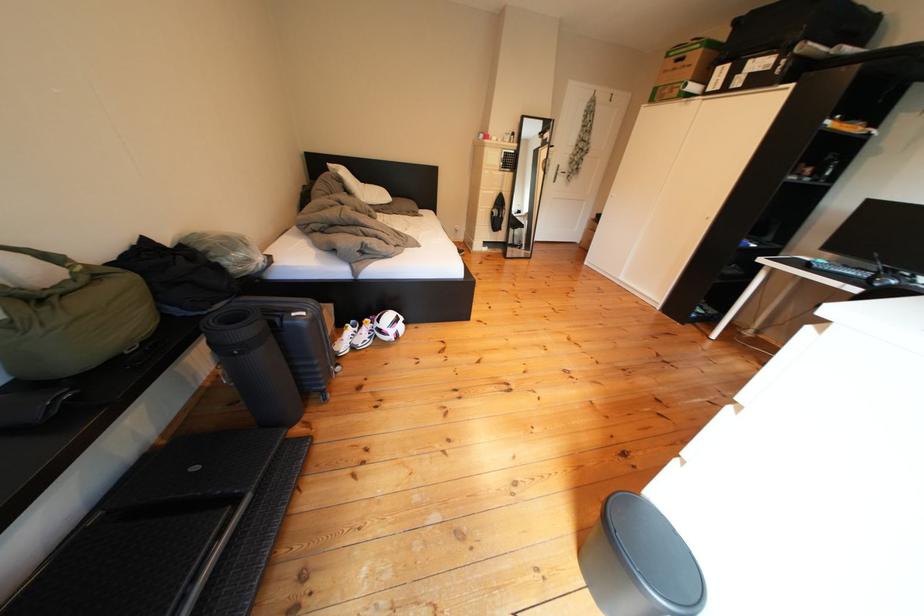
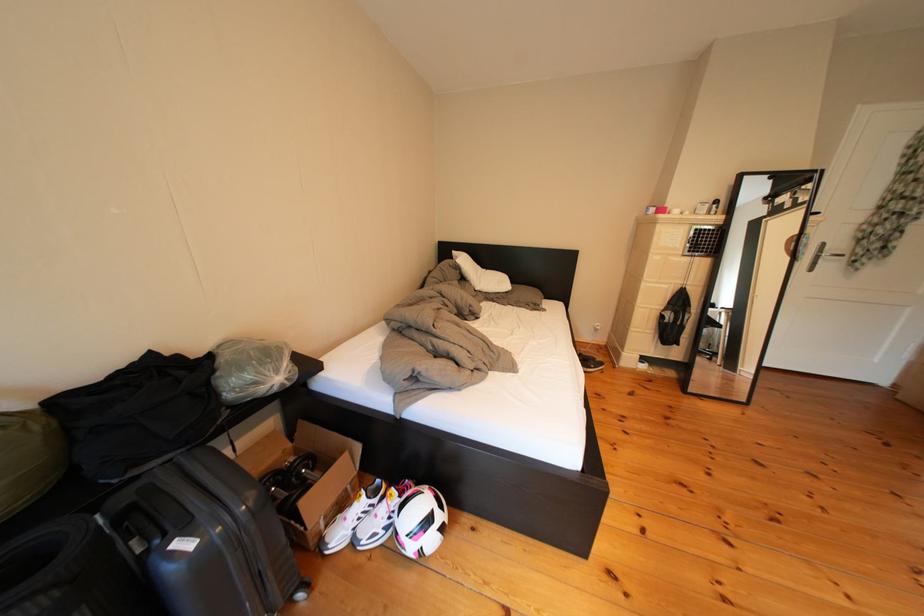
Question: How did the camera likely rotate?

Choices:
 (A) Left
 (B) Right
 (C) Up
 (D) Down

Answer: (A)